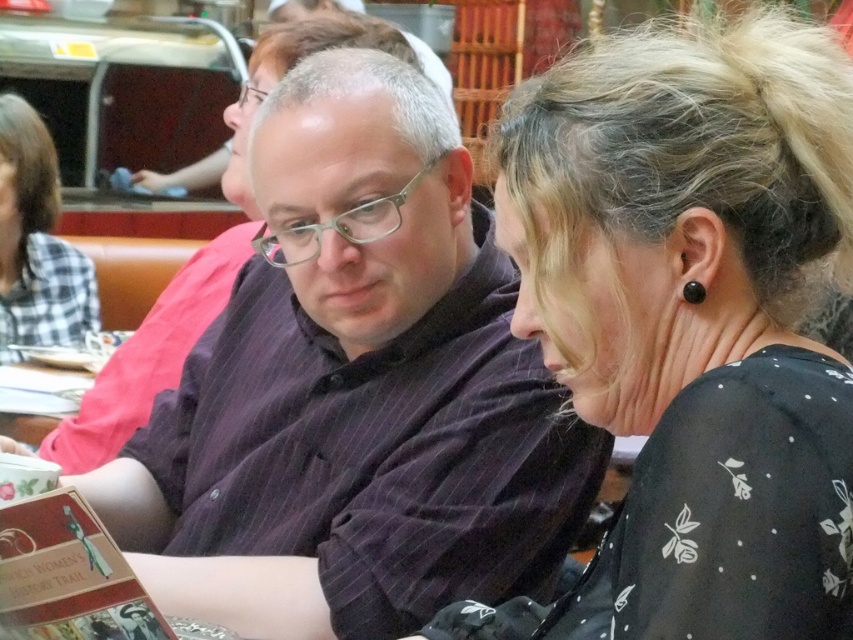
In order to click on dark pinstriped shirt at center in this screenshot , I will do `click(354, 392)`.

Looking at this image, can you confirm if dark pinstriped shirt at center is positioned below black dotted blouse at center?

Incorrect, dark pinstriped shirt at center is not positioned below black dotted blouse at center.

Locate an element on the screen. dark pinstriped shirt at center is located at coordinates (354, 392).

This screenshot has width=853, height=640. What are the coordinates of `dark pinstriped shirt at center` in the screenshot? It's located at (354, 392).

Is black dotted blouse at center bigger than plaid fabric shirt at upper left?

Indeed, black dotted blouse at center has a larger size compared to plaid fabric shirt at upper left.

Who is positioned more to the right, black dotted blouse at center or plaid fabric shirt at upper left?

black dotted blouse at center is more to the right.

Between point (596, 269) and point (13, 195), which one is positioned behind?

The point (13, 195) is more distant.

The width and height of the screenshot is (853, 640). I want to click on black dotted blouse at center, so click(689, 323).

How much distance is there between dark pinstriped shirt at center and plaid fabric shirt at upper left?

The distance of dark pinstriped shirt at center from plaid fabric shirt at upper left is 1.76 meters.

Find the location of a particular element. dark pinstriped shirt at center is located at coordinates (354, 392).